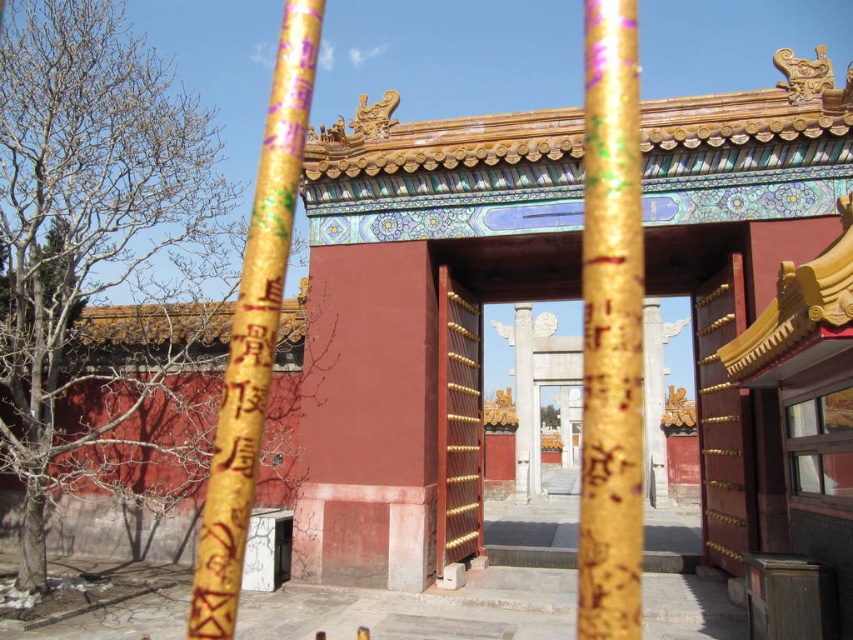
Question: Among these points, which one is nearest to the camera?

Choices:
 (A) (614, 576)
 (B) (289, 184)
 (C) (467, 284)

Answer: (B)

Question: From the image, what is the correct spatial relationship of gold painted wooden pole at center in relation to smooth wood gate at center?

Choices:
 (A) right
 (B) left

Answer: (B)

Question: Can you confirm if gold glittering pole at center is positioned above gold painted wooden pole at center?

Choices:
 (A) yes
 (B) no

Answer: (B)

Question: Which point is farther to the camera?

Choices:
 (A) smooth wood gate at center
 (B) gold glittering pole at center

Answer: (A)

Question: Does gold glittering pole at center have a smaller size compared to gold painted wooden pole at center?

Choices:
 (A) no
 (B) yes

Answer: (B)

Question: Among these objects, which one is farthest from the camera?

Choices:
 (A) gold painted wooden pole at center
 (B) gold glittering pole at center
 (C) smooth wood gate at center

Answer: (C)